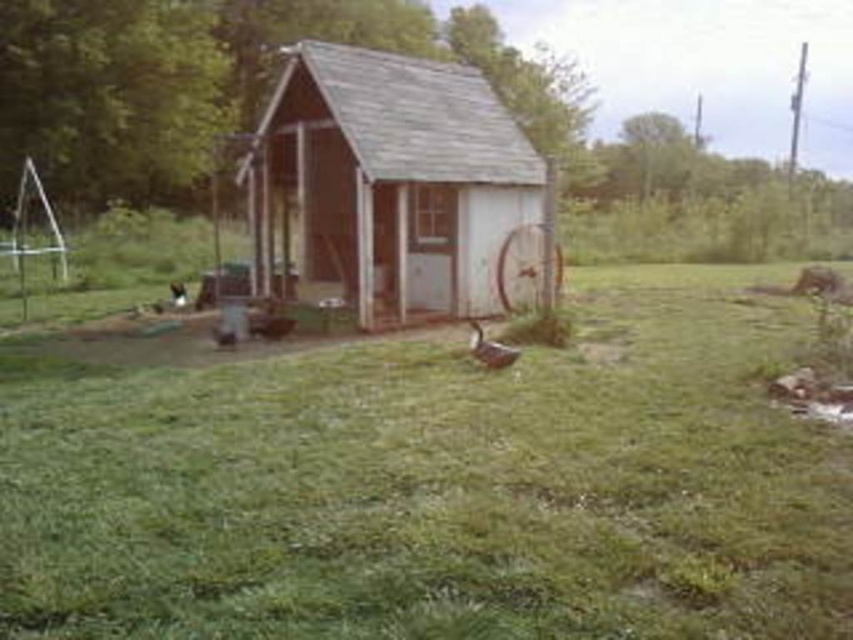
Question: Which point is closer to the camera taking this photo?

Choices:
 (A) (418, 193)
 (B) (432, 630)
 (C) (515, 352)

Answer: (B)

Question: From the image, what is the correct spatial relationship of green grass at center in relation to brown matte duck at center?

Choices:
 (A) above
 (B) below

Answer: (B)

Question: Does green grass at center have a greater width compared to brown matte duck at center?

Choices:
 (A) no
 (B) yes

Answer: (B)

Question: Which object is the farthest from the wooden shed at center?

Choices:
 (A) green grass at center
 (B) brown matte duck at center

Answer: (A)

Question: Among these points, which one is nearest to the camera?

Choices:
 (A) (335, 232)
 (B) (1, 540)

Answer: (B)

Question: Does wooden shed at center have a larger size compared to brown matte duck at center?

Choices:
 (A) yes
 (B) no

Answer: (B)